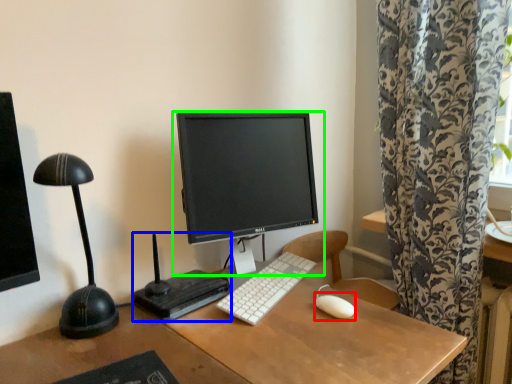
Question: Which object is the closest to the mouse (highlighted by a red box)? Choose among these: equipment (highlighted by a blue box) or computer monitor (highlighted by a green box).

Choices:
 (A) equipment
 (B) computer monitor

Answer: (A)